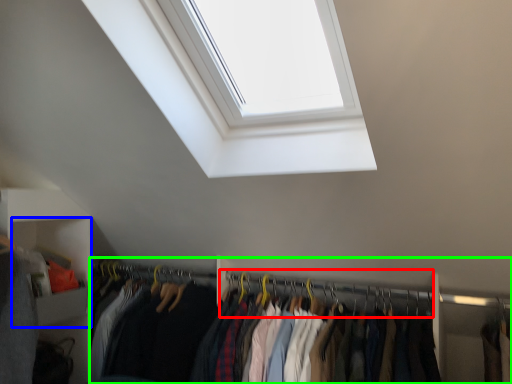
Question: Estimate the real-world distances between objects in this image. Which object is farther from hanger (highlighted by a red box), cabinet (highlighted by a blue box) or closet (highlighted by a green box)?

Choices:
 (A) cabinet
 (B) closet

Answer: (A)